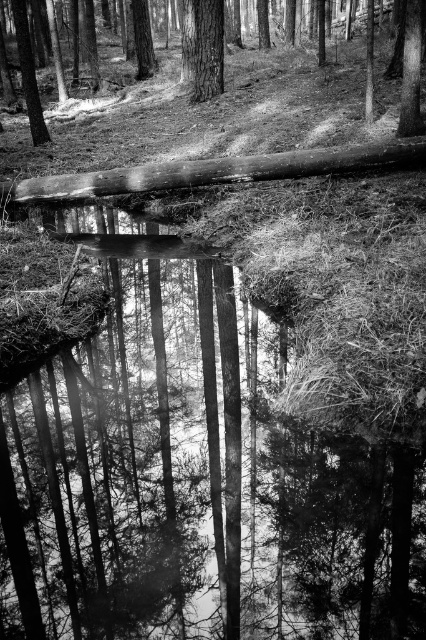
Question: Which point is closer to the camera?

Choices:
 (A) smooth bark tree at upper left
 (B) smooth bark tree at upper center
 (C) smooth bark tree at center

Answer: (B)

Question: Is the position of smooth wooden log at center less distant than that of smooth bark tree at center?

Choices:
 (A) yes
 (B) no

Answer: (A)

Question: Which point is farther to the camera?

Choices:
 (A) smooth bark tree at upper center
 (B) smooth wooden log at center

Answer: (A)

Question: Is smooth wooden log at center below smooth bark tree at upper left?

Choices:
 (A) no
 (B) yes

Answer: (B)

Question: Is smooth bark tree at upper center thinner than smooth bark tree at upper left?

Choices:
 (A) yes
 (B) no

Answer: (B)

Question: Which point is closer to the camera?

Choices:
 (A) smooth bark tree at upper center
 (B) smooth wooden log at center
 (C) smooth bark tree at upper left

Answer: (B)